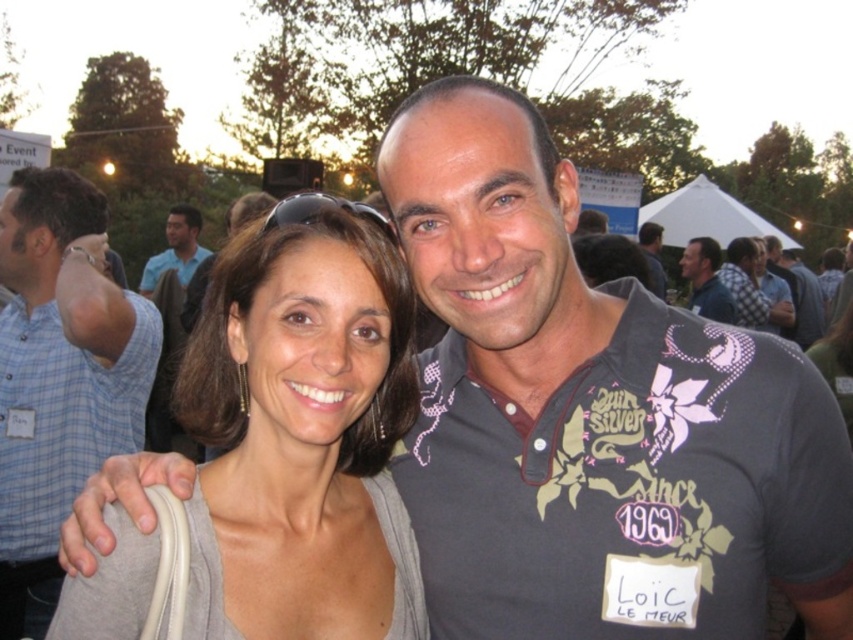
Consider the image. You are an event organizer setting up a photo booth backdrop. You have two gray items to choose from in the scene. The gray fabric at center and the matte gray sweater at center. Which one is shorter in height?

The gray fabric at center is shorter in height compared to the matte gray sweater at center.

You are a photographer at the event and need to position a backdrop that must be taller than both the blue plaid shirt at left and the dark gray shirt at center. Based on their heights, which shirt should the backdrop be taller than?

The blue plaid shirt at left is taller than the dark gray shirt at center, so the backdrop must be taller than the blue plaid shirt at left to accommodate both.